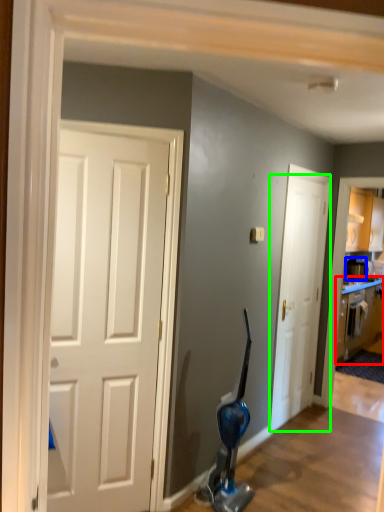
Question: Estimate the real-world distances between objects in this image. Which object is closer to cabinetry (highlighted by a red box), appliance (highlighted by a blue box) or door (highlighted by a green box)?

Choices:
 (A) appliance
 (B) door

Answer: (A)